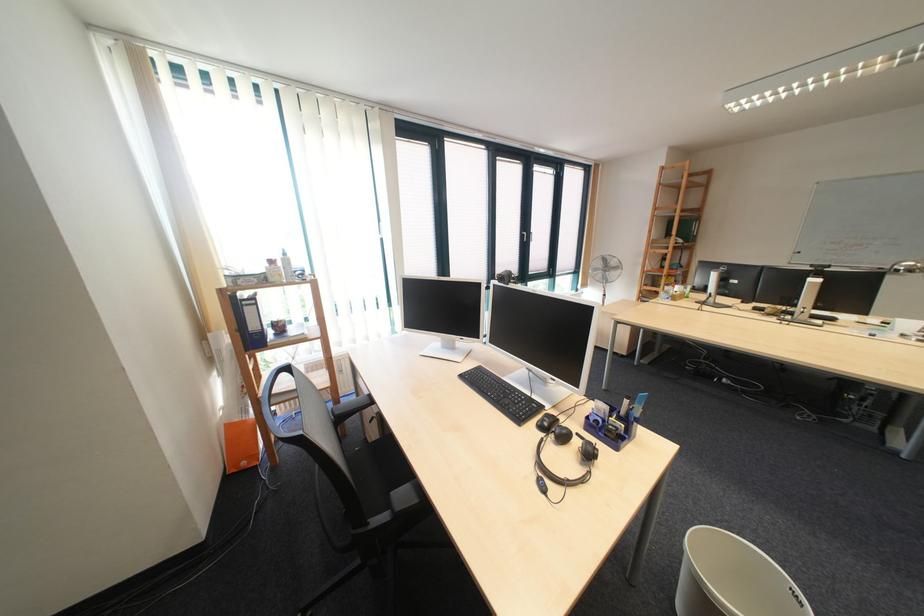
This screenshot has width=924, height=616. In order to click on silver door handle in this screenshot , I will do `click(536, 238)`.